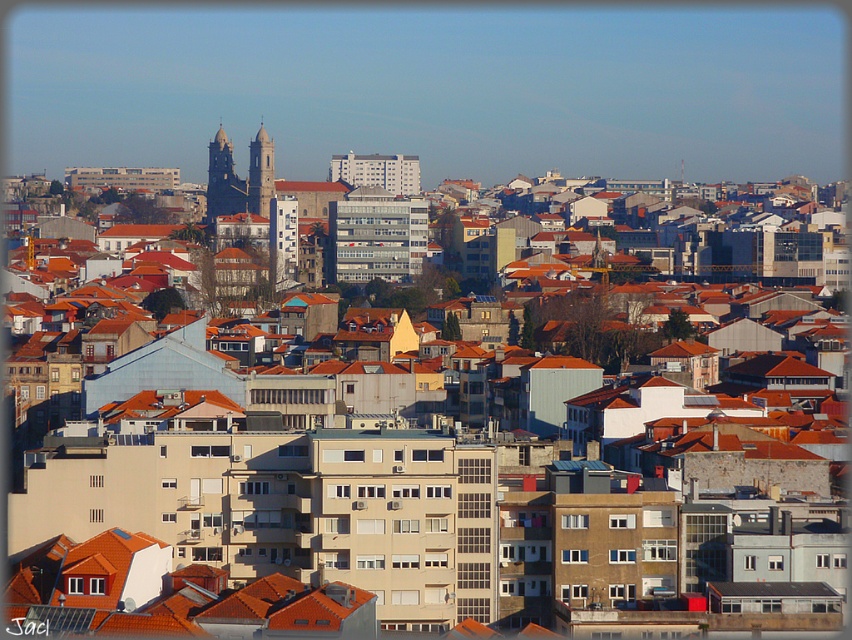
Question: Does dark gray stone tower at upper center appear on the left side of smooth stone tower at center?

Choices:
 (A) no
 (B) yes

Answer: (B)

Question: Is dark gray stone tower at upper center above smooth stone tower at center?

Choices:
 (A) no
 (B) yes

Answer: (A)

Question: Observing the image, what is the correct spatial positioning of dark gray stone tower at upper center in reference to smooth stone tower at center?

Choices:
 (A) left
 (B) right

Answer: (A)

Question: Among these points, which one is nearest to the camera?

Choices:
 (A) (257, 161)
 (B) (246, 186)

Answer: (A)